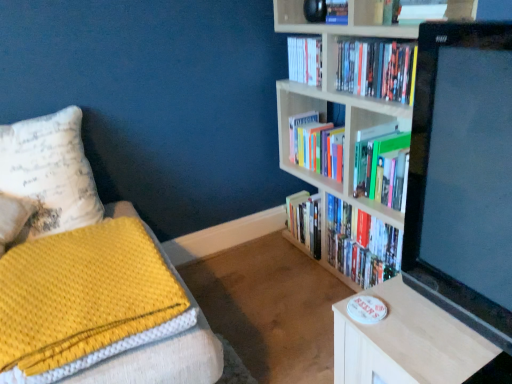
Image resolution: width=512 pixels, height=384 pixels. Find the location of `vacant area on top of light wood table at lower right (from a real-world perspective)`. vacant area on top of light wood table at lower right (from a real-world perspective) is located at coordinates (426, 326).